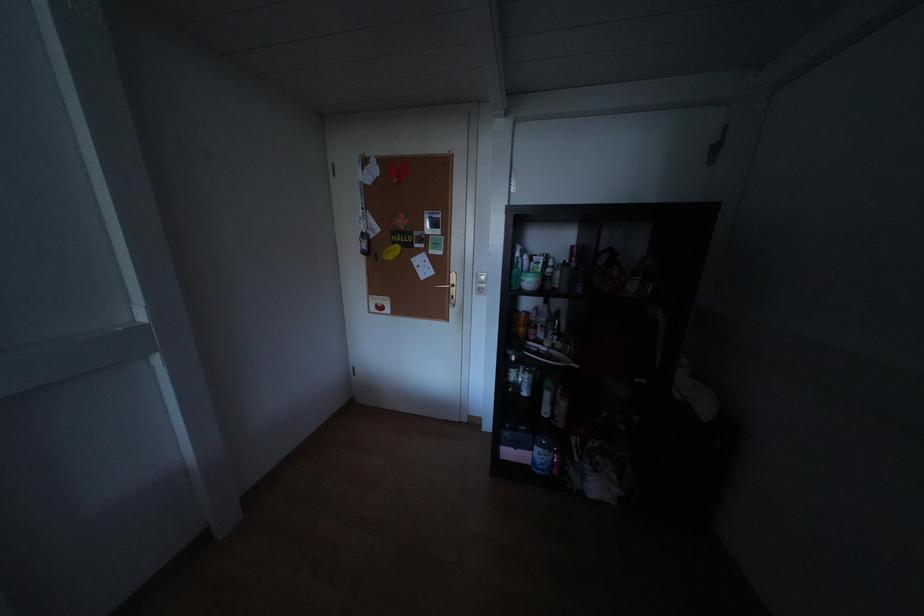
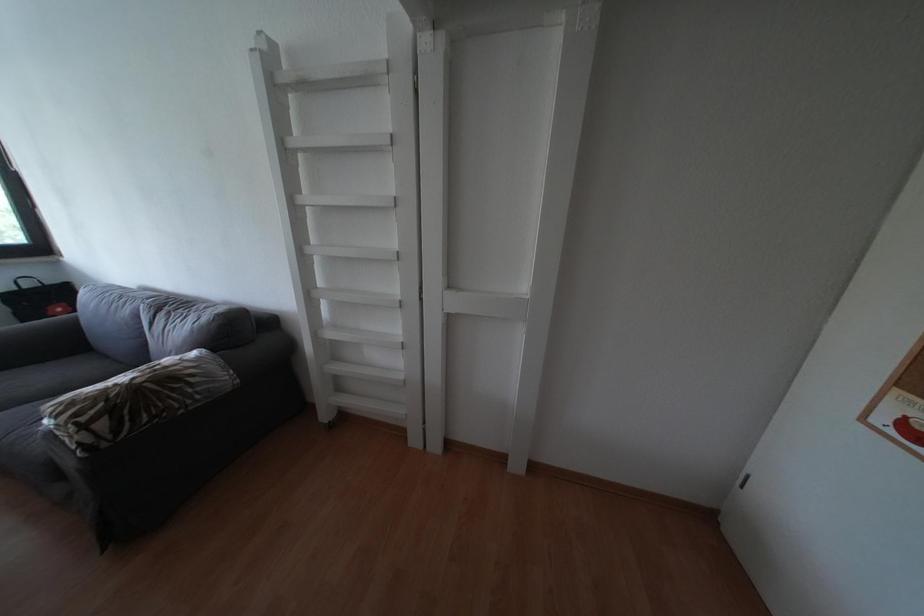
First-person continuous shooting, in which direction is the camera rotating?

The camera rotated toward left-down.